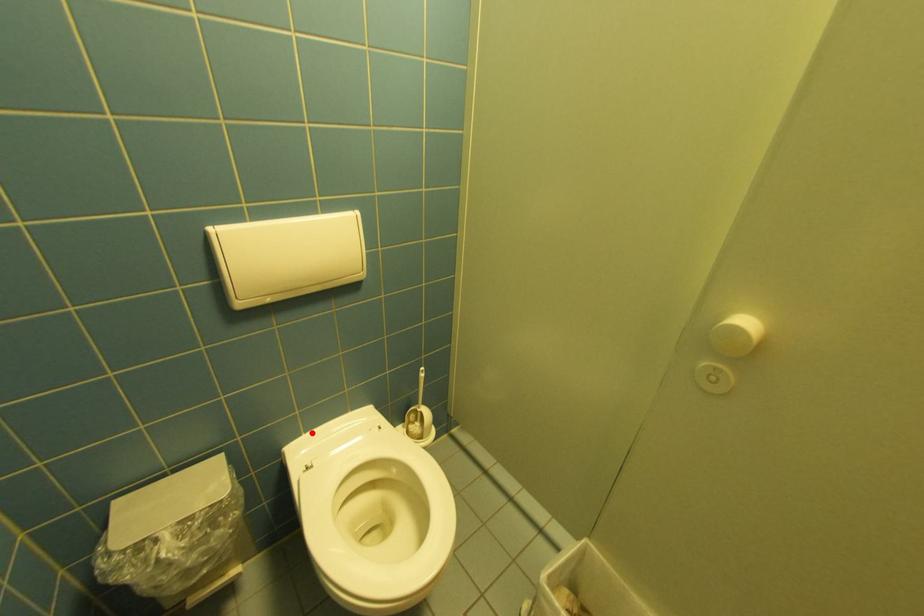
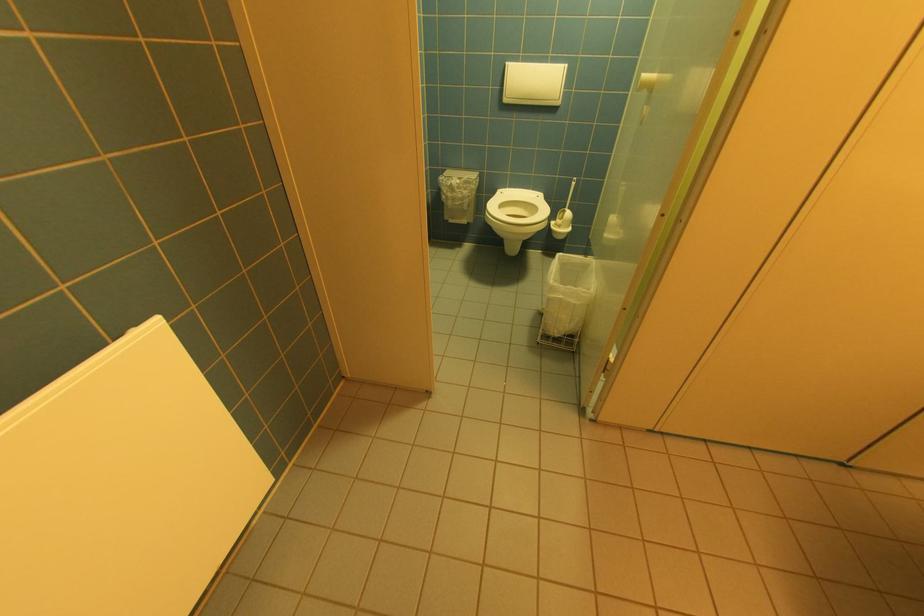
Find the pixel in the second image that matches the highlighted location in the first image.

(515, 188)